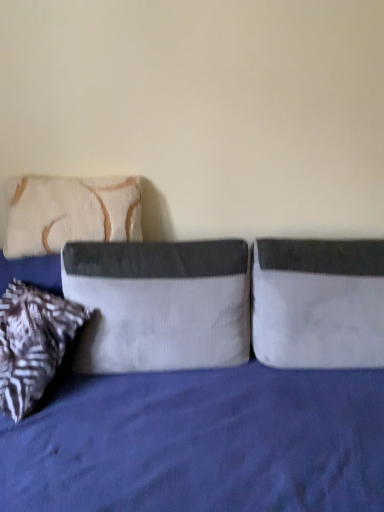
Question: Is velvet blue bed at center to the right of white fabric pillow at right, the 3th pillow when ordered from left to right, from the viewer's perspective?

Choices:
 (A) yes
 (B) no

Answer: (B)

Question: From a real-world perspective, is velvet blue bed at center over white fabric pillow at right, placed as the first pillow when sorted from right to left?

Choices:
 (A) no
 (B) yes

Answer: (A)

Question: Is white fabric pillow at right, placed as the first pillow when sorted from right to left, at the back of velvet blue bed at center?

Choices:
 (A) yes
 (B) no

Answer: (A)

Question: Could you tell me if velvet blue bed at center is turned towards white fabric pillow at right, the 3th pillow when ordered from left to right?

Choices:
 (A) yes
 (B) no

Answer: (A)

Question: Does velvet blue bed at center have a greater height compared to white fabric pillow at right, placed as the first pillow when sorted from right to left?

Choices:
 (A) yes
 (B) no

Answer: (A)

Question: Can you confirm if velvet blue bed at center is wider than white fabric pillow at right, the 3th pillow when ordered from left to right?

Choices:
 (A) no
 (B) yes

Answer: (B)

Question: Is beige textured pillow at left, placed as the first pillow when sorted from left to right, positioned before velvet blue bed at center?

Choices:
 (A) no
 (B) yes

Answer: (A)

Question: Can you confirm if beige textured pillow at left, placed as the first pillow when sorted from left to right, is smaller than velvet blue bed at center?

Choices:
 (A) yes
 (B) no

Answer: (A)

Question: From the image's perspective, is beige textured pillow at left, the 3th pillow when ordered from right to left, under velvet blue bed at center?

Choices:
 (A) yes
 (B) no

Answer: (B)

Question: Does beige textured pillow at left, placed as the first pillow when sorted from left to right, appear on the right side of velvet blue bed at center?

Choices:
 (A) yes
 (B) no

Answer: (B)

Question: Is beige textured pillow at left, placed as the first pillow when sorted from left to right, shorter than velvet blue bed at center?

Choices:
 (A) no
 (B) yes

Answer: (B)

Question: Does beige textured pillow at left, placed as the first pillow when sorted from left to right, lie behind velvet blue bed at center?

Choices:
 (A) yes
 (B) no

Answer: (A)

Question: Is velvet gray pillow at center, which appears as the 2th pillow when viewed from the right, far away from beige textured pillow at left, placed as the first pillow when sorted from left to right?

Choices:
 (A) yes
 (B) no

Answer: (B)